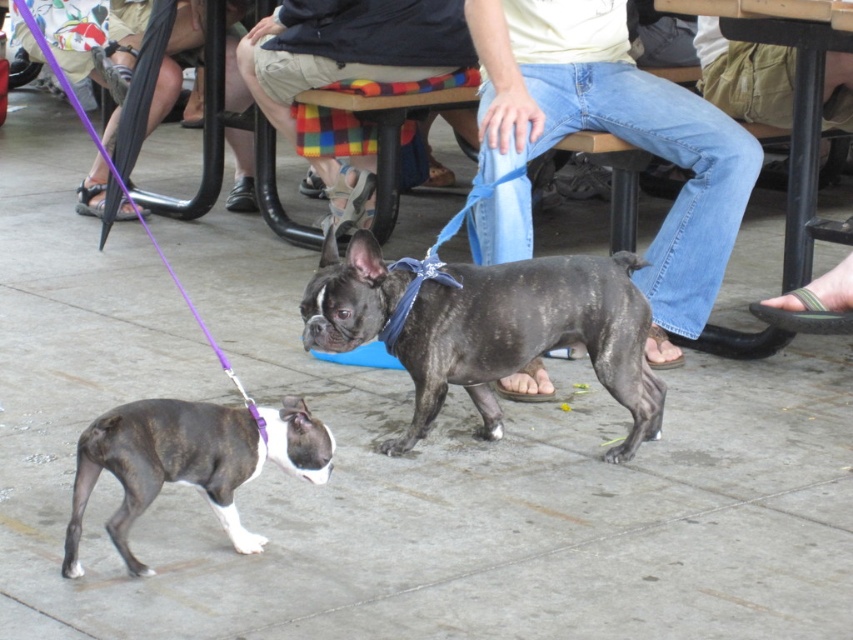
Question: Which point is closer to the camera?

Choices:
 (A) shiny black dog at center
 (B) brindle fur dog at lower left

Answer: (B)

Question: Does brindle fur dog at lower left appear on the left side of brushed metal picnic table at lower right?

Choices:
 (A) yes
 (B) no

Answer: (A)

Question: Based on their relative distances, which object is nearer to the brushed metal picnic table at lower right?

Choices:
 (A) brushed metal leash at upper left
 (B) shiny black dog at center
 (C) denim jeans at center

Answer: (C)

Question: Where is shiny black dog at center located in relation to purple fabric leash at upper left in the image?

Choices:
 (A) below
 (B) above

Answer: (A)

Question: Does shiny black dog at center appear on the left side of brushed metal picnic table at lower right?

Choices:
 (A) no
 (B) yes

Answer: (B)

Question: Which point appears closest to the camera in this image?

Choices:
 (A) (x=163, y=72)
 (B) (x=349, y=33)
 (C) (x=77, y=51)

Answer: (B)